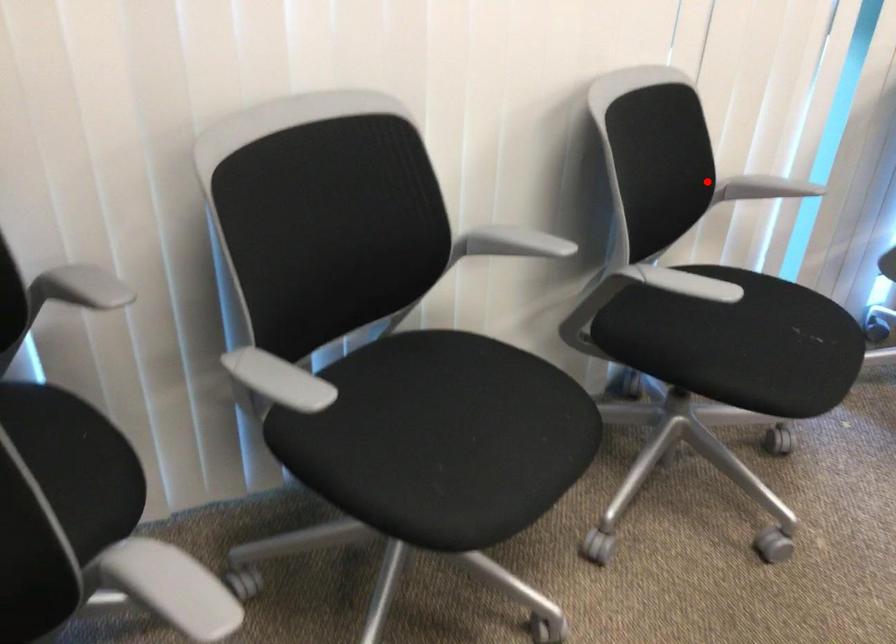
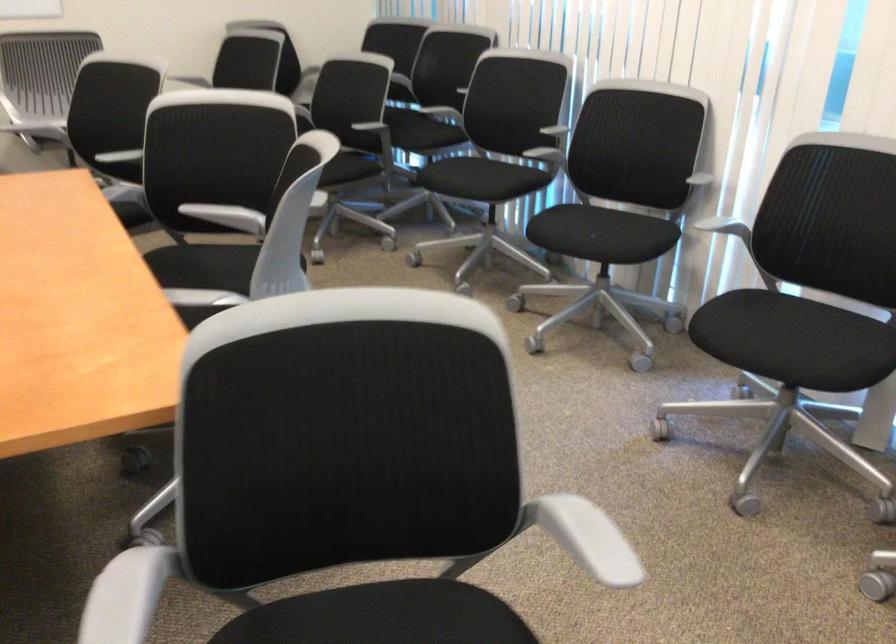
Locate, in the second image, the point that corresponds to the highlighted location in the first image.

(693, 174)